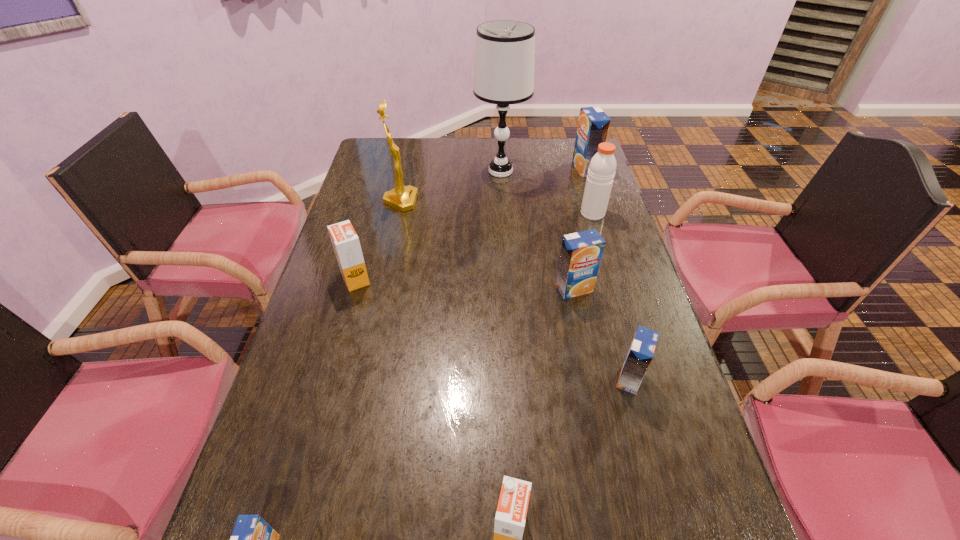
The height and width of the screenshot is (540, 960). Identify the location of white table lamp. (505, 49).

You are a GUI agent. You are given a task and a screenshot of the screen. Output one action in this format:
    pyautogui.click(x=<x>, y=<y>)
    Task: Click on the tallest object
    This screenshot has height=540, width=960.
    Given the screenshot: What is the action you would take?
    pyautogui.click(x=505, y=49)

This screenshot has height=540, width=960. I want to click on the eighth shortest object, so tap(403, 198).

Image resolution: width=960 pixels, height=540 pixels. I want to click on golden award, so click(x=403, y=198).

At what (x,y) coordinates should I click in order to perform the action: click on orange shaker. Please return your answer as a coordinate pair (x, y). Looking at the image, I should click on (601, 172).

Find the location of `the tallest orange_juice`. the tallest orange_juice is located at coordinates tap(593, 125).

Find the location of a particular element. The width and height of the screenshot is (960, 540). the biggest blue orange_juice is located at coordinates 593,125.

Where is `the third smallest blue orange_juice`? Image resolution: width=960 pixels, height=540 pixels. the third smallest blue orange_juice is located at coordinates (581, 252).

Image resolution: width=960 pixels, height=540 pixels. I want to click on the left orange orange juice, so click(x=346, y=244).

This screenshot has height=540, width=960. What are the coordinates of `the bigger orange orange juice` in the screenshot? It's located at click(x=346, y=244).